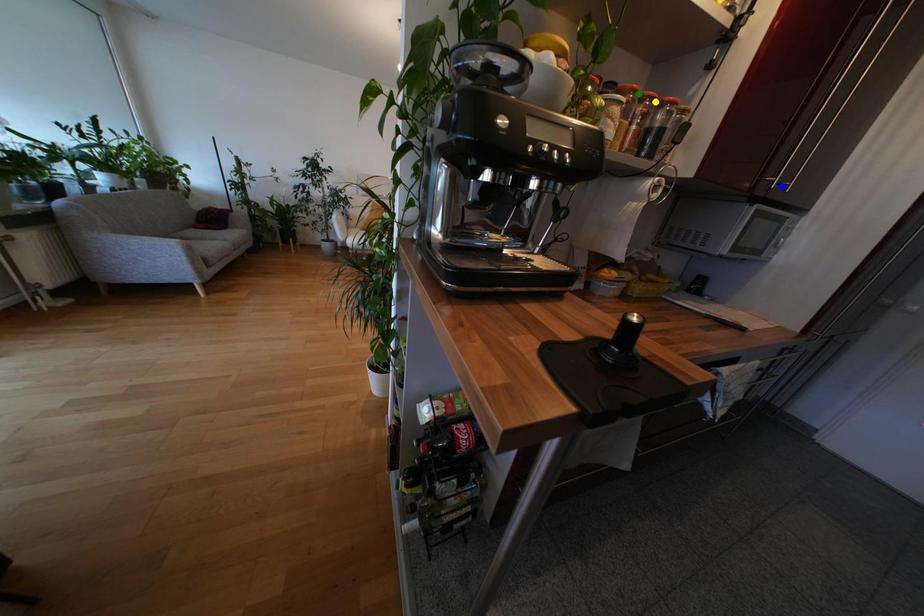
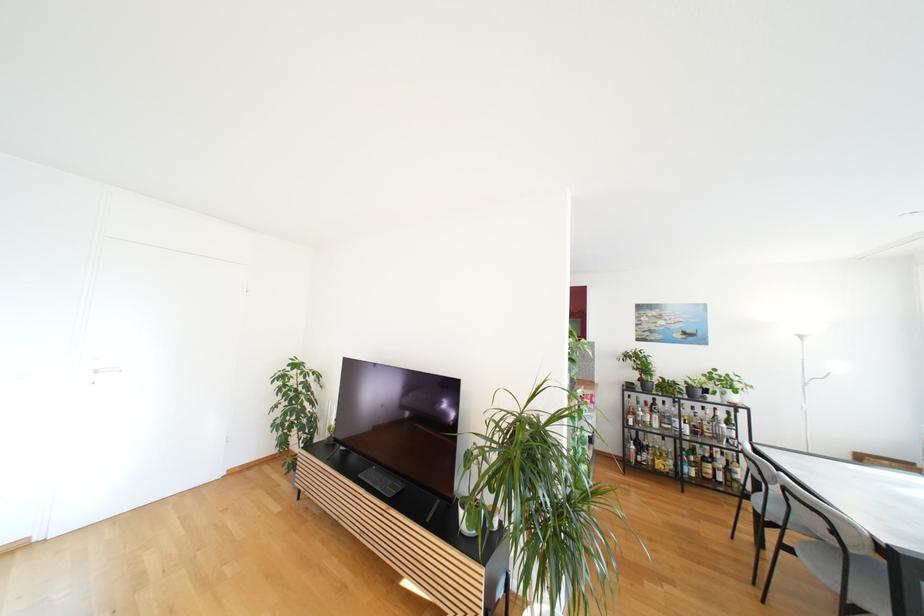
I am providing you with two images of the same scene from different viewpoints. Three points are marked in image1. Which point corresponds to a part or object that is occluded in image2?In image1, three points are marked. Which of them correspond to a part or object that is occluded in image2?Among the three points shown in image1, which one corresponds to a part or object that is no longer visible due to occlusion in image2?

Invisible in image2: blue point, green point, yellow point.